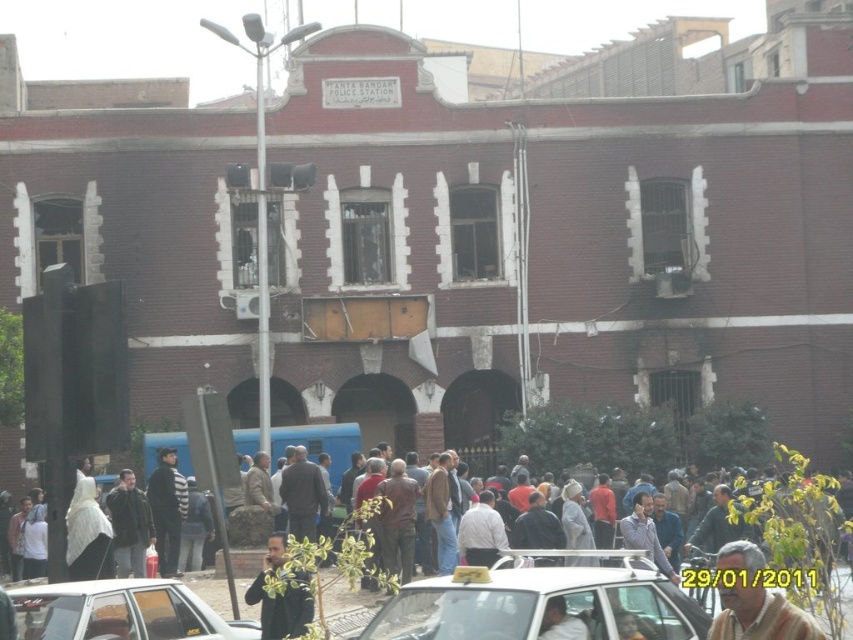
Measure the distance between point [523,609] and camera.

They are 47.07 meters apart.

Between point (585, 616) and point (770, 624), which one is positioned behind?

The point (770, 624) is more distant.

The width and height of the screenshot is (853, 640). What are the coordinates of `white plastic taxi at center` in the screenshot? It's located at (543, 605).

Who is more forward, (189, 529) or (561, 627)?

Point (561, 627)

Which is below, striped fabric jacket at center or light brown leather jacket at center?

striped fabric jacket at center is lower down.

Who is more forward, (186, 564) or (547, 616)?

Point (547, 616)

At what (x,y) coordinates should I click in order to perform the action: click on striped fabric jacket at center. Please return your answer as a coordinate pair (x, y). This screenshot has width=853, height=640. Looking at the image, I should click on (194, 529).

How distant is white plastic taxi at center from light brown leather jacket at center?

white plastic taxi at center is 1.97 meters away from light brown leather jacket at center.

Which of these two, white plastic taxi at center or light brown leather jacket at center, stands taller?

With more height is white plastic taxi at center.

Is point (532, 576) closer to viewer compared to point (556, 604)?

That is False.

You are a GUI agent. You are given a task and a screenshot of the screen. Output one action in this format:
    pyautogui.click(x=<x>, y=<y>)
    Task: Click on the white plastic taxi at center
    This screenshot has width=853, height=640.
    Given the screenshot: What is the action you would take?
    pyautogui.click(x=543, y=605)